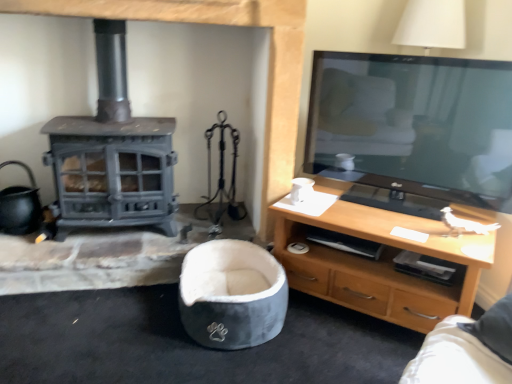
The image size is (512, 384). I want to click on free space in front of velvet grey bean bag chair at center, so click(217, 366).